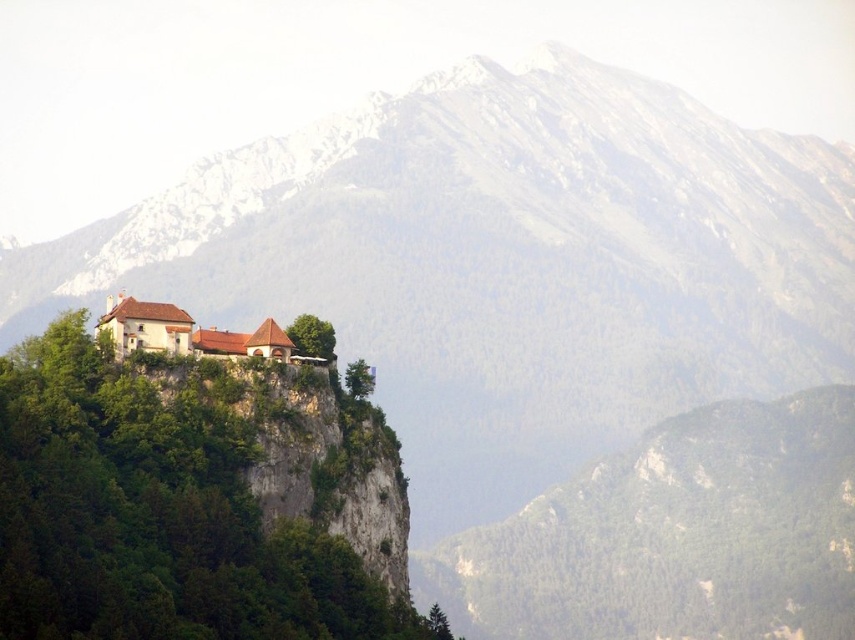
Question: Which point is closer to the camera taking this photo?

Choices:
 (A) (658, 500)
 (B) (230, 337)

Answer: (B)

Question: Is green forested hill at center positioned at the back of white stone building at center?

Choices:
 (A) yes
 (B) no

Answer: (A)

Question: Which point appears farthest from the camera in this image?

Choices:
 (A) (767, 611)
 (B) (273, 356)

Answer: (A)

Question: Does green forested hill at center have a lesser width compared to white stone building at center?

Choices:
 (A) no
 (B) yes

Answer: (A)

Question: Does green forested hill at center have a greater width compared to white stone building at center?

Choices:
 (A) yes
 (B) no

Answer: (A)

Question: Which object appears farthest from the camera in this image?

Choices:
 (A) white stone building at center
 (B) green forested hill at center

Answer: (B)